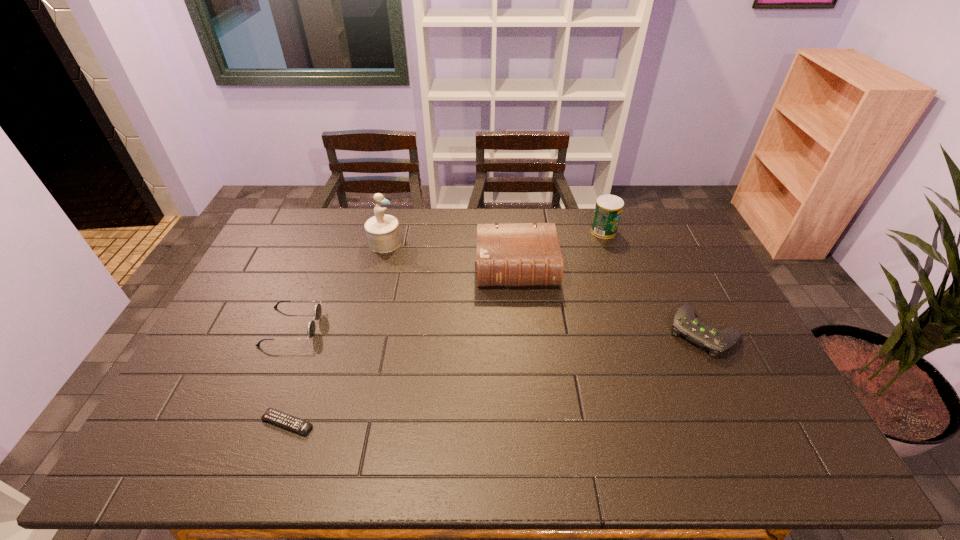
Locate an element on the screen. This screenshot has width=960, height=540. the tallest object is located at coordinates (383, 234).

You are a GUI agent. You are given a task and a screenshot of the screen. Output one action in this format:
    pyautogui.click(x=<x>, y=<y>)
    Task: Click on the figurine
    The width and height of the screenshot is (960, 540).
    Given the screenshot: What is the action you would take?
    pyautogui.click(x=383, y=234)

Image resolution: width=960 pixels, height=540 pixels. What are the coordinates of `the fifth object from left to right` in the screenshot? It's located at (608, 209).

At what (x,y) coordinates should I click in order to perform the action: click on the third object from right to left. Please return your answer as a coordinate pair (x, y). Image resolution: width=960 pixels, height=540 pixels. Looking at the image, I should click on click(x=525, y=254).

Find the location of a particular element. The image size is (960, 540). sunglasses is located at coordinates (311, 327).

Find the location of a particular element. The image size is (960, 540). the rightmost object is located at coordinates (685, 324).

In order to click on remote control in this screenshot , I will do tap(272, 415).

Where is `the shortest object`? the shortest object is located at coordinates (272, 415).

The image size is (960, 540). I want to click on vacant space located at the beak of the third object from left to right, so click(462, 243).

Identify the location of vacant area situated 0.250m on the front of the can. This screenshot has width=960, height=540. (622, 286).